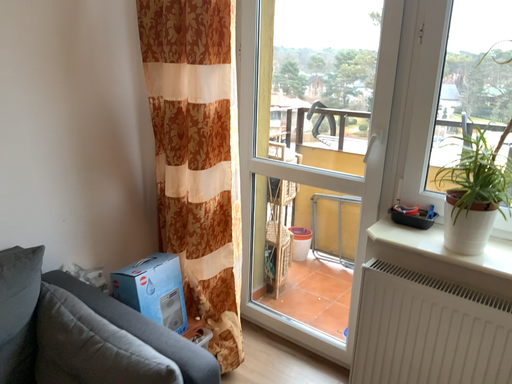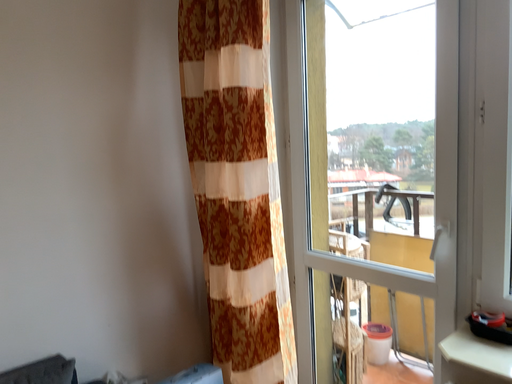
Question: How did the camera likely rotate when shooting the video?

Choices:
 (A) rotated downward
 (B) rotated upward

Answer: (B)